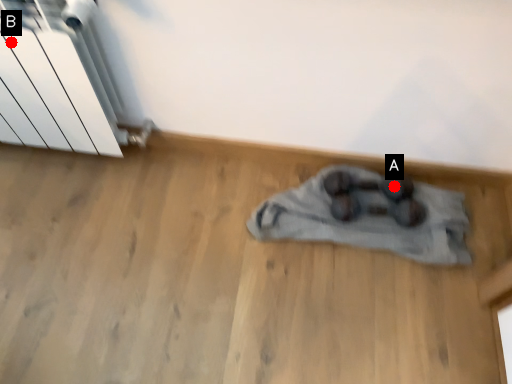
Question: Two points are circled on the image, labeled by A and B beside each circle. Which point is farther to the camera?

Choices:
 (A) A is further
 (B) B is further

Answer: (A)